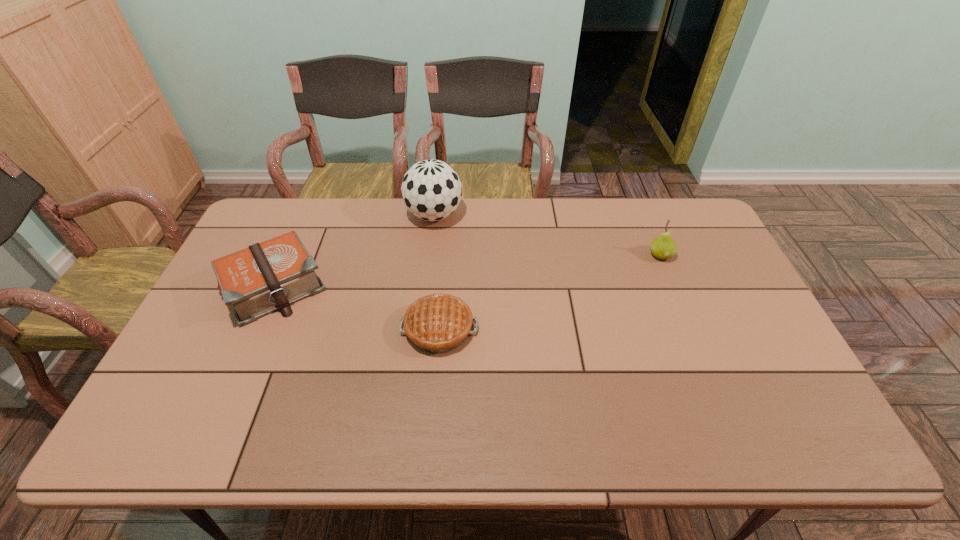
Locate an element on the screen. vacant area located on the right of the pie is located at coordinates (550, 328).

Find the location of `object that is at the far edge`. object that is at the far edge is located at coordinates (431, 190).

At what (x,y) coordinates should I click in order to perform the action: click on object present at the left edge. Please return your answer as a coordinate pair (x, y). This screenshot has width=960, height=540. Looking at the image, I should click on (268, 276).

You are a GUI agent. You are given a task and a screenshot of the screen. Output one action in this format:
    pyautogui.click(x=<x>, y=<y>)
    Task: Click on the free space at the far edge
    The height and width of the screenshot is (540, 960).
    Given the screenshot: What is the action you would take?
    pyautogui.click(x=565, y=237)

Where is `vacant position at the near edge of the desktop`? vacant position at the near edge of the desktop is located at coordinates (363, 437).

This screenshot has width=960, height=540. In the image, there is a desktop. In order to click on vacant space at the right edge in this screenshot , I will do `click(683, 244)`.

The height and width of the screenshot is (540, 960). Identify the location of free location at the near left corner. (181, 437).

This screenshot has width=960, height=540. Find the location of `blank region between the pear and the Bible`. blank region between the pear and the Bible is located at coordinates (468, 271).

What are the coordinates of `vacant area that lies between the third shortest object and the soccer ball` in the screenshot? It's located at (547, 235).

Where is `vacant area that lies between the pie and the second shortest object`? This screenshot has width=960, height=540. vacant area that lies between the pie and the second shortest object is located at coordinates (357, 308).